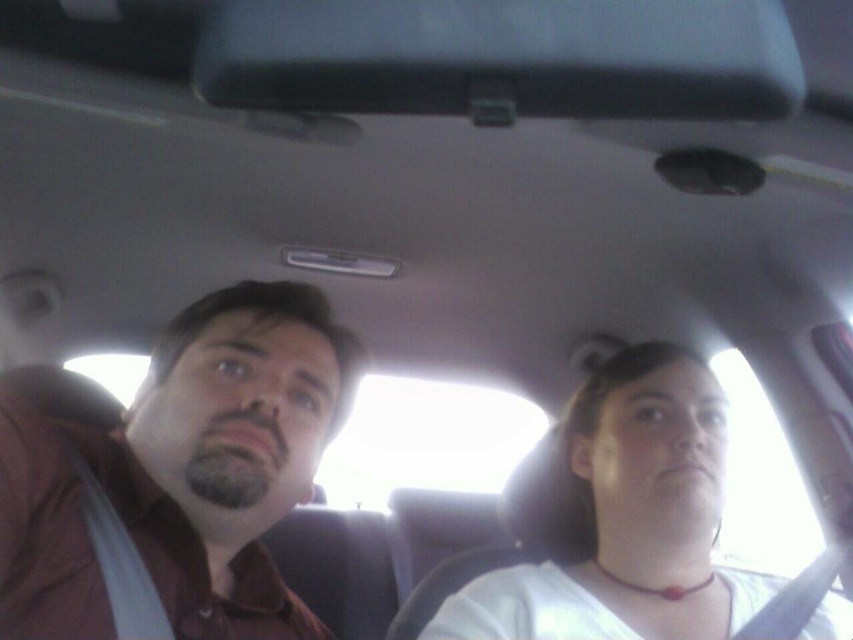
Which of these two, brown matte shirt at left or white matte shirt at center, stands shorter?

Standing shorter between the two is white matte shirt at center.

Which is below, brown matte shirt at left or white matte shirt at center?

Positioned lower is white matte shirt at center.

Is point (357, 364) closer to camera compared to point (624, 605)?

That is False.

You are a GUI agent. You are given a task and a screenshot of the screen. Output one action in this format:
    pyautogui.click(x=<x>, y=<y>)
    Task: Click on the brown matte shirt at left
    
    Given the screenshot: What is the action you would take?
    pyautogui.click(x=178, y=476)